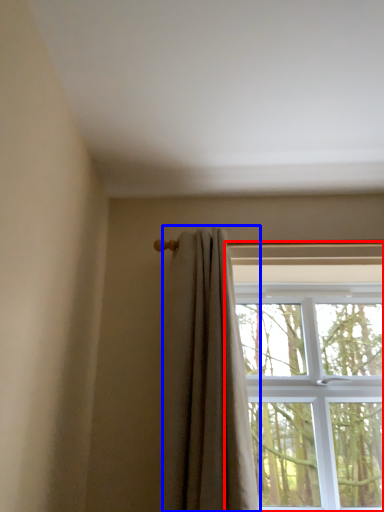
Question: Which object appears closest to the camera in this image, window (highlighted by a red box) or curtain (highlighted by a blue box)?

Choices:
 (A) window
 (B) curtain

Answer: (B)